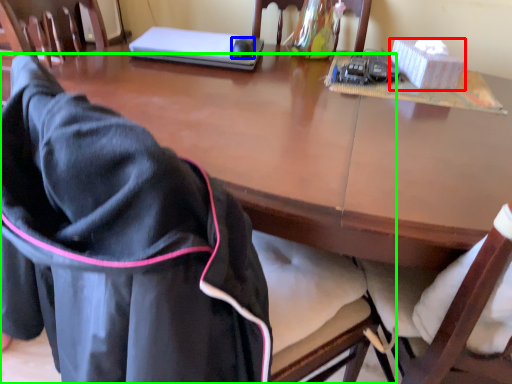
Question: Which is farther away from box (highlighted by a red box)? mouse (highlighted by a blue box) or chair (highlighted by a green box)?

Choices:
 (A) mouse
 (B) chair

Answer: (B)